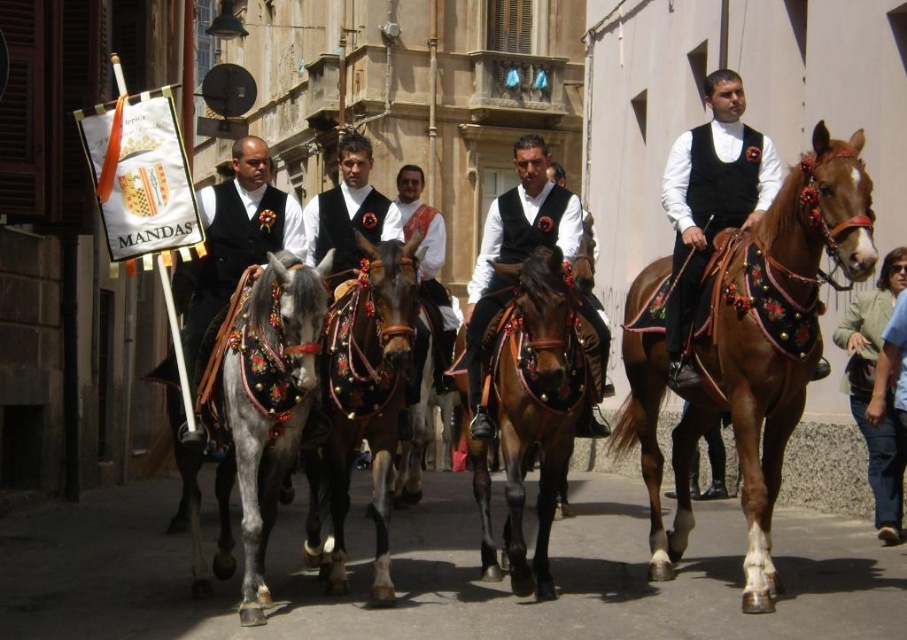
You are standing in the street watching the horse parade. There are two points in the scene, one at coordinate point (708, 225) and the other at point (436, 310). Which point is closer to you?

Point (708, 225) is closer to the viewer than point (436, 310).

You are a photographer standing at the starting point of the parade route. You want to take a photo that includes both the brown glossy horse at center and the green fabric jacket at lower right. Given that your camera has a maximum zoom range of 10 meters, will you be able to capture both subjects in a single frame without moving your position?

The brown glossy horse at center is 15.64 meters from the green fabric jacket at lower right. Since your camera can only zoom up to 10 meters, you won me be able to capture both subjects in a single frame without moving your position.

You are a photographer capturing the scene of men on horses in a parade. You notice two vests among the riders. The first is a matte black vest at left, and the second is a white satin vest at center. From your perspective, which vest appears lower in the image?

The matte black vest at left appears lower in the image because it is located below the white satin vest at center.